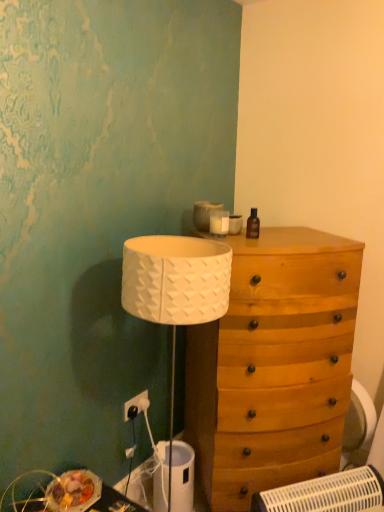
Locate an element on the screen. vacant area that is in front of brown glass bottle at upper right is located at coordinates point(256,247).